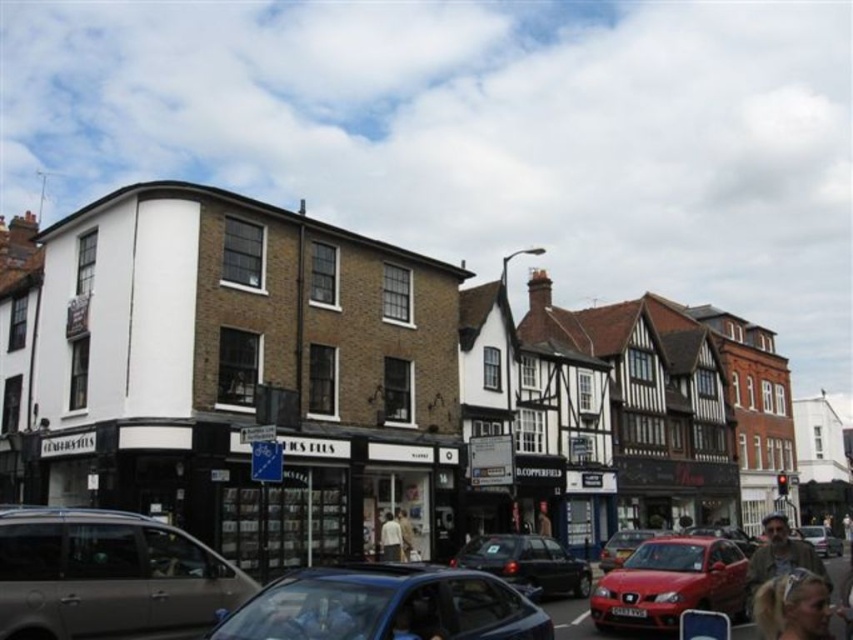
Question: Can you confirm if brown leather jacket at lower right is positioned below red matte car at center?

Choices:
 (A) no
 (B) yes

Answer: (A)

Question: Estimate the real-world distances between objects in this image. Which object is farther from the red matte car at center?

Choices:
 (A) shiny black sedan at center
 (B) matte black car at center

Answer: (B)

Question: Among these points, which one is farthest from the camera?

Choices:
 (A) (610, 557)
 (B) (810, 621)

Answer: (A)

Question: Considering the relative positions of shiny black sedan at center and light beige fabric shirt at center in the image provided, where is shiny black sedan at center located with respect to light beige fabric shirt at center?

Choices:
 (A) right
 (B) left

Answer: (A)

Question: Which point appears farthest from the camera in this image?

Choices:
 (A) (515, 573)
 (B) (776, 557)

Answer: (A)

Question: Does shiny black sedan at center have a larger size compared to red matte car at center?

Choices:
 (A) no
 (B) yes

Answer: (A)